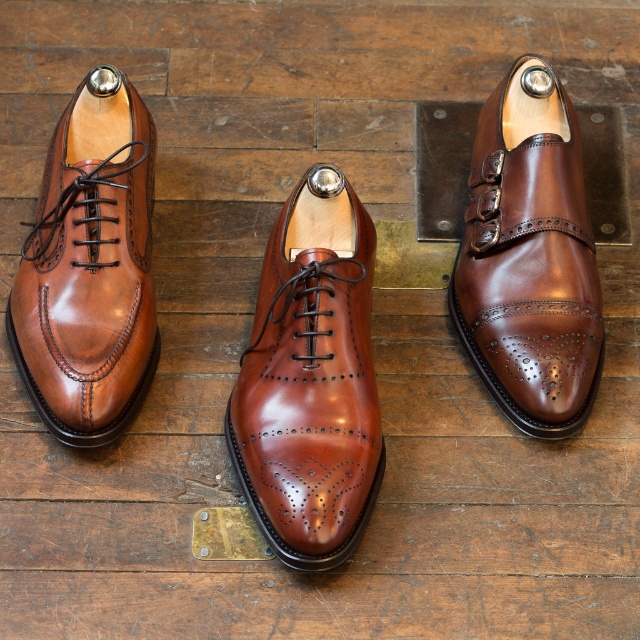
Question: Considering the relative positions of shiny brown leather shoe at upper center and matte brown leather shoe at left in the image provided, where is shiny brown leather shoe at upper center located with respect to matte brown leather shoe at left?

Choices:
 (A) right
 (B) left

Answer: (A)

Question: Is shiny brown leather shoe at center thinner than shiny brown leather shoe at upper center?

Choices:
 (A) no
 (B) yes

Answer: (A)

Question: Is the position of shiny brown leather shoe at center less distant than that of matte brown leather shoe at left?

Choices:
 (A) no
 (B) yes

Answer: (B)

Question: Which object appears closest to the camera in this image?

Choices:
 (A) matte brown leather shoe at left
 (B) shiny brown leather shoe at upper center
 (C) shiny brown leather shoe at center

Answer: (C)

Question: Estimate the real-world distances between objects in this image. Which object is closer to the shiny brown leather shoe at center?

Choices:
 (A) matte brown leather shoe at left
 (B) shiny brown leather shoe at upper center

Answer: (A)

Question: Which object appears farthest from the camera in this image?

Choices:
 (A) matte brown leather shoe at left
 (B) shiny brown leather shoe at center

Answer: (A)